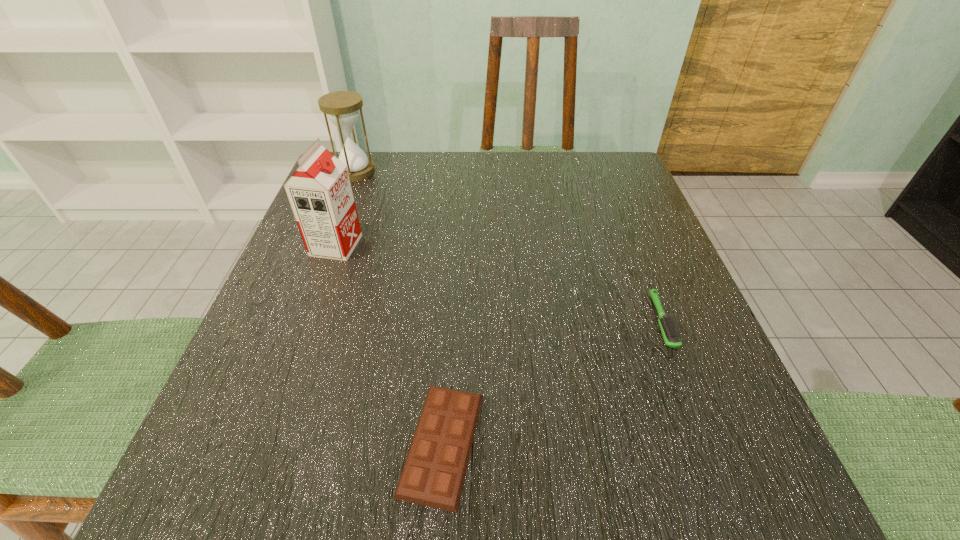
Locate an element on the screen. This screenshot has height=540, width=960. vacant space located 0.350m on the left of the third tallest object is located at coordinates (444, 321).

This screenshot has width=960, height=540. I want to click on free space located on the back of the chocolate bar, so click(x=453, y=273).

This screenshot has width=960, height=540. Find the location of `object that is at the far edge`. object that is at the far edge is located at coordinates (342, 107).

You are a GUI agent. You are given a task and a screenshot of the screen. Output one action in this format:
    pyautogui.click(x=<x>, y=<y>)
    Task: Click on the object that is positioned at the near edge
    Image resolution: width=960 pixels, height=540 pixels.
    Given the screenshot: What is the action you would take?
    pyautogui.click(x=434, y=471)

Locate an element on the screen. Image resolution: width=960 pixels, height=540 pixels. soya milk present at the left edge is located at coordinates (320, 194).

Where is `hourglass situated at the left edge`? hourglass situated at the left edge is located at coordinates (342, 107).

The image size is (960, 540). What are the coordinates of `object that is at the right edge` in the screenshot? It's located at (671, 334).

Find the location of `object present at the far left corner`. object present at the far left corner is located at coordinates (342, 107).

Image resolution: width=960 pixels, height=540 pixels. I want to click on vacant space at the far edge of the desktop, so click(533, 172).

Image resolution: width=960 pixels, height=540 pixels. In the image, there is a desktop. Find the location of `vacant space at the near edge`. vacant space at the near edge is located at coordinates (473, 496).